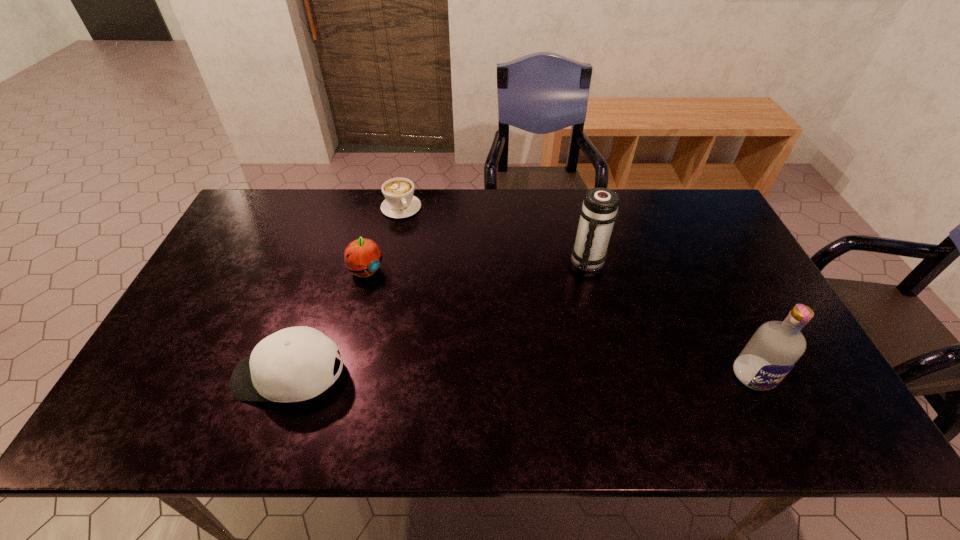
This screenshot has height=540, width=960. What are the coordinates of `vacant space located on the side with the handle of the thermos bottle` in the screenshot? It's located at (577, 393).

Locate an element on the screen. free space located 0.070m on the side with the handle of the thermos bottle is located at coordinates (586, 293).

This screenshot has height=540, width=960. In order to click on free space located 0.340m on the surface of the apple in this screenshot , I will do `click(463, 345)`.

Identify the location of vacant space located 0.110m on the surface of the apple. This screenshot has height=540, width=960. (402, 299).

The height and width of the screenshot is (540, 960). Find the location of `blank area located on the surface of the apple`. blank area located on the surface of the apple is located at coordinates (398, 296).

You are a GUI agent. You are given a task and a screenshot of the screen. Output one action in this format:
    pyautogui.click(x=<x>, y=<y>)
    Task: Click on the blank space located 0.330m to the right of the shortest object's handle
    This screenshot has width=960, height=540.
    Given the screenshot: What is the action you would take?
    pyautogui.click(x=448, y=283)

Locate an element on the screen. free space located 0.350m to the right of the shortest object's handle is located at coordinates (451, 287).

Image resolution: width=960 pixels, height=540 pixels. I want to click on free space located to the right of the shortest object's handle, so click(x=430, y=253).

At what (x,y) coordinates should I click in order to perform the action: click on object that is positioned at the far edge. Please return your answer as a coordinate pair (x, y). This screenshot has width=960, height=540. Looking at the image, I should click on (399, 202).

Locate an element on the screen. Image resolution: width=960 pixels, height=540 pixels. baseball cap present at the near edge is located at coordinates (294, 364).